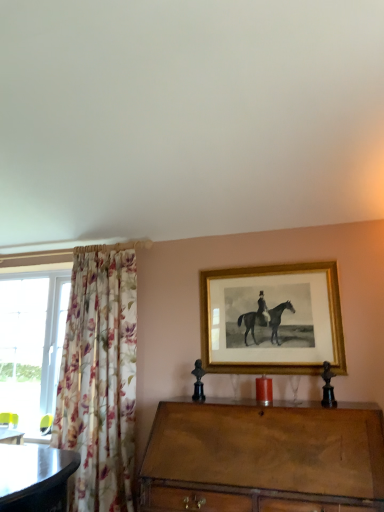
Question: Does gold/gilded picture frame at upper center have a greater width compared to wooden chest of drawers at center?

Choices:
 (A) no
 (B) yes

Answer: (A)

Question: From the image's perspective, is gold/gilded picture frame at upper center above wooden chest of drawers at center?

Choices:
 (A) yes
 (B) no

Answer: (A)

Question: Is gold/gilded picture frame at upper center next to wooden chest of drawers at center and touching it?

Choices:
 (A) no
 (B) yes

Answer: (A)

Question: Is wooden chest of drawers at center a part of gold/gilded picture frame at upper center?

Choices:
 (A) no
 (B) yes

Answer: (A)

Question: Considering the relative sizes of gold/gilded picture frame at upper center and wooden chest of drawers at center in the image provided, is gold/gilded picture frame at upper center shorter than wooden chest of drawers at center?

Choices:
 (A) yes
 (B) no

Answer: (A)

Question: Is gold/gilded picture frame at upper center closer to the viewer compared to wooden chest of drawers at center?

Choices:
 (A) yes
 (B) no

Answer: (B)

Question: Is brown wooden desk at lower left positioned before wooden chest of drawers at center?

Choices:
 (A) yes
 (B) no

Answer: (B)

Question: Is brown wooden desk at lower left further to the viewer compared to wooden chest of drawers at center?

Choices:
 (A) yes
 (B) no

Answer: (A)

Question: Would you say brown wooden desk at lower left is a long distance from wooden chest of drawers at center?

Choices:
 (A) no
 (B) yes

Answer: (B)

Question: From a real-world perspective, is brown wooden desk at lower left located beneath wooden chest of drawers at center?

Choices:
 (A) yes
 (B) no

Answer: (B)

Question: Could wooden chest of drawers at center be considered to be inside brown wooden desk at lower left?

Choices:
 (A) no
 (B) yes

Answer: (A)

Question: Can you confirm if brown wooden desk at lower left is thinner than wooden chest of drawers at center?

Choices:
 (A) no
 (B) yes

Answer: (B)

Question: Is the depth of brown wooden desk at lower left less than that of floral fabric curtain at left?

Choices:
 (A) no
 (B) yes

Answer: (A)